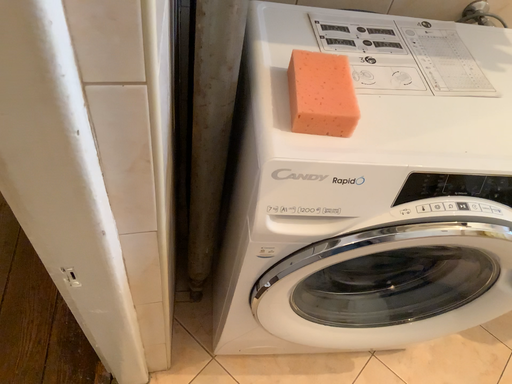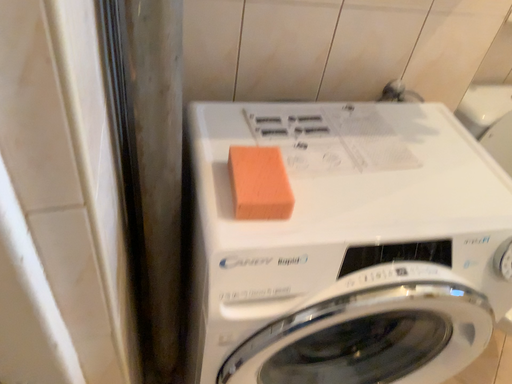
Question: How did the camera likely rotate when shooting the video?

Choices:
 (A) rotated upward
 (B) rotated downward

Answer: (A)